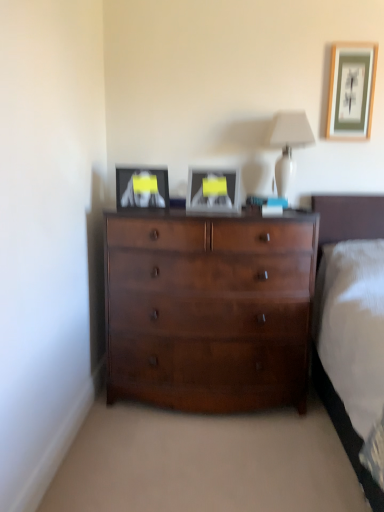
Question: Is matte black picture frame at upper left, which is the first picture frame from bottom to top, positioned far away from white glossy table lamp at upper center?

Choices:
 (A) no
 (B) yes

Answer: (A)

Question: Is matte black picture frame at upper left, the third picture frame when ordered from right to left, positioned with its back to white glossy table lamp at upper center?

Choices:
 (A) yes
 (B) no

Answer: (B)

Question: Can you confirm if matte black picture frame at upper left, arranged as the first picture frame when viewed from the left, is bigger than white glossy table lamp at upper center?

Choices:
 (A) yes
 (B) no

Answer: (B)

Question: Does matte black picture frame at upper left, marked as the third picture frame in a top-to-bottom arrangement, have a lesser height compared to white glossy table lamp at upper center?

Choices:
 (A) no
 (B) yes

Answer: (B)

Question: Could white glossy table lamp at upper center be considered to be inside matte black picture frame at upper left, the third picture frame when ordered from right to left?

Choices:
 (A) yes
 (B) no

Answer: (B)

Question: Which is correct: matte black picture frame at upper left, the third picture frame when ordered from right to left, is inside shiny brown dresser at center, or outside of it?

Choices:
 (A) outside
 (B) inside

Answer: (A)

Question: Is matte black picture frame at upper left, which is the first picture frame from bottom to top, in front of or behind shiny brown dresser at center in the image?

Choices:
 (A) front
 (B) behind

Answer: (B)

Question: Would you say matte black picture frame at upper left, arranged as the first picture frame when viewed from the left, is to the left or to the right of shiny brown dresser at center in the picture?

Choices:
 (A) left
 (B) right

Answer: (A)

Question: Considering the positions of matte black picture frame at upper left, which is the first picture frame from bottom to top, and shiny brown dresser at center in the image, is matte black picture frame at upper left, which is the first picture frame from bottom to top, taller or shorter than shiny brown dresser at center?

Choices:
 (A) tall
 (B) short

Answer: (B)

Question: Is matte silver picture frame at center, which is the second picture frame from top to bottom, in front of or behind white glossy table lamp at upper center in the image?

Choices:
 (A) front
 (B) behind

Answer: (A)

Question: Do you think matte silver picture frame at center, marked as the second picture frame in a left-to-right arrangement, is within white glossy table lamp at upper center, or outside of it?

Choices:
 (A) inside
 (B) outside

Answer: (B)

Question: From a real-world perspective, relative to white glossy table lamp at upper center, is matte silver picture frame at center, marked as the second picture frame in a left-to-right arrangement, vertically above or below?

Choices:
 (A) below
 (B) above

Answer: (A)

Question: Based on their positions, is matte silver picture frame at center, which is the second picture frame from top to bottom, located to the left or right of white glossy table lamp at upper center?

Choices:
 (A) right
 (B) left

Answer: (B)

Question: From the image's perspective, is white glossy table lamp at upper center above or below matte black picture frame at upper left, marked as the third picture frame in a top-to-bottom arrangement?

Choices:
 (A) above
 (B) below

Answer: (A)

Question: Is white glossy table lamp at upper center to the left or to the right of matte black picture frame at upper left, arranged as the first picture frame when viewed from the left, in the image?

Choices:
 (A) left
 (B) right

Answer: (B)